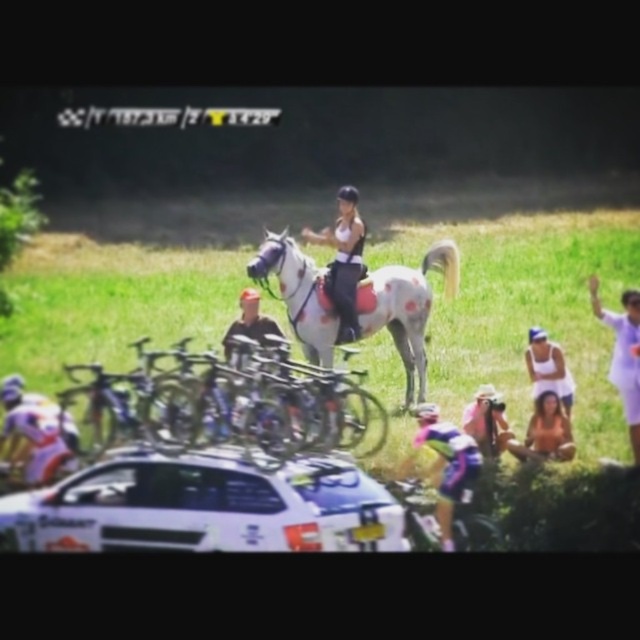
You are a cyclist participating in the race and you need to navigate between two checkpoints marked by point coordinates. The first checkpoint is at point (385,416) and the second is at point (419,289). Based on the scene description, which checkpoint is closer to the starting line?

Point (385,416) is in front of point (419,289), so the first checkpoint at point (385,416) is closer to the starting line.

From the picture: You are a cyclist participating in the race and want to know the shortest path to reach the finish line. There are two checkpoints marked as point 1 at point (426, 252) and point 2 at point (545, 416). Which checkpoint should you reach first to take the shortest path?

Point 1 at point (426, 252) is behind point 2 at point (545, 416), so you should reach point 2 first to take the shortest path.